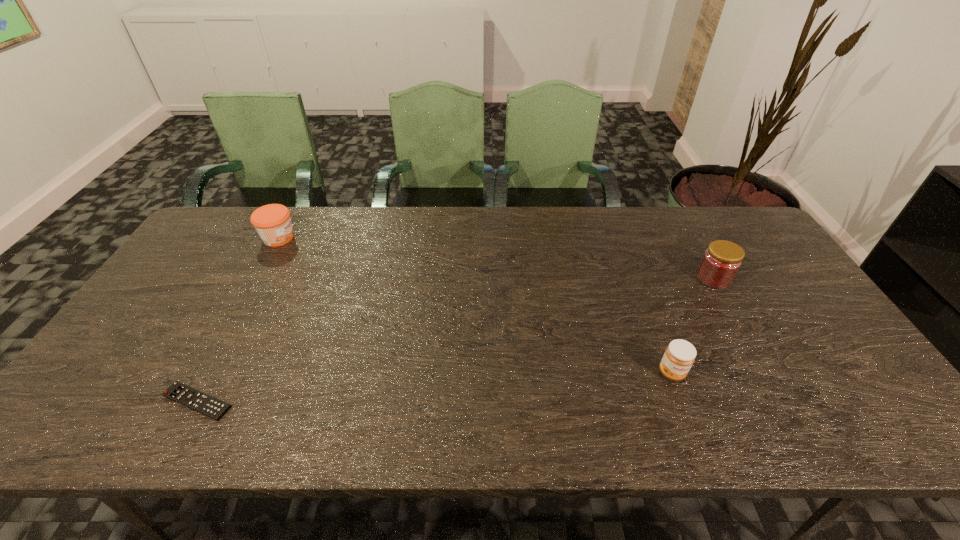
Image resolution: width=960 pixels, height=540 pixels. Identify the location of object located at the far edge. (272, 222).

Identify the location of object situated at the near edge. This screenshot has height=540, width=960. point(185,395).

Locate an element on the screen. The image size is (960, 540). vacant area at the far edge of the desktop is located at coordinates (563, 235).

Locate an element on the screen. The height and width of the screenshot is (540, 960). free region at the near edge of the desktop is located at coordinates (717, 416).

Locate an element on the screen. The height and width of the screenshot is (540, 960). vacant area at the right edge is located at coordinates (795, 330).

Where is `free space between the farthest object and the shortest object`? This screenshot has height=540, width=960. free space between the farthest object and the shortest object is located at coordinates (238, 320).

Locate an element on the screen. Image resolution: width=960 pixels, height=540 pixels. free space between the nearest jam and the shortest object is located at coordinates (435, 387).

The height and width of the screenshot is (540, 960). I want to click on free spot between the remote control and the nearest jam, so click(435, 387).

Identify the location of empty space between the remote control and the second jam from left to right. (435, 387).

Locate an element on the screen. The height and width of the screenshot is (540, 960). empty space that is in between the leftmost jam and the second nearest jam is located at coordinates (496, 258).